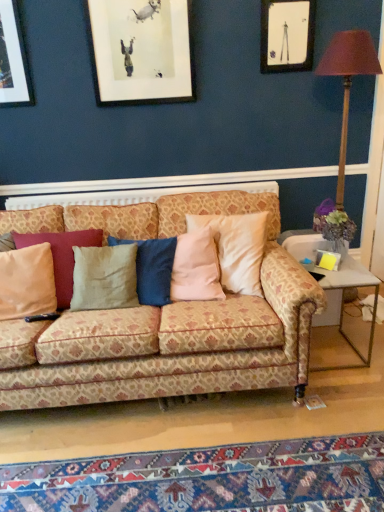
Question: Can you confirm if carpet with intricate patterns at lower center is positioned to the left of patterned fabric couch at center?

Choices:
 (A) yes
 (B) no

Answer: (B)

Question: Can you confirm if carpet with intricate patterns at lower center is shorter than patterned fabric couch at center?

Choices:
 (A) no
 (B) yes

Answer: (B)

Question: Is carpet with intricate patterns at lower center facing away from patterned fabric couch at center?

Choices:
 (A) yes
 (B) no

Answer: (B)

Question: From the image's perspective, is carpet with intricate patterns at lower center on top of patterned fabric couch at center?

Choices:
 (A) yes
 (B) no

Answer: (B)

Question: Is carpet with intricate patterns at lower center bigger than patterned fabric couch at center?

Choices:
 (A) no
 (B) yes

Answer: (A)

Question: Is carpet with intricate patterns at lower center beside patterned fabric couch at center?

Choices:
 (A) yes
 (B) no

Answer: (B)

Question: Is matte black picture frame at upper right placed right next to metallic gold table lamp at right?

Choices:
 (A) yes
 (B) no

Answer: (B)

Question: Does matte black picture frame at upper right have a greater height compared to metallic gold table lamp at right?

Choices:
 (A) no
 (B) yes

Answer: (A)

Question: Considering the relative sizes of matte black picture frame at upper right and metallic gold table lamp at right in the image provided, is matte black picture frame at upper right wider than metallic gold table lamp at right?

Choices:
 (A) no
 (B) yes

Answer: (A)

Question: Considering the relative positions of matte black picture frame at upper right and metallic gold table lamp at right in the image provided, is matte black picture frame at upper right to the left of metallic gold table lamp at right from the viewer's perspective?

Choices:
 (A) no
 (B) yes

Answer: (B)

Question: Is matte black picture frame at upper right looking in the opposite direction of metallic gold table lamp at right?

Choices:
 (A) yes
 (B) no

Answer: (B)

Question: Is matte black picture frame at upper right smaller than metallic gold table lamp at right?

Choices:
 (A) yes
 (B) no

Answer: (A)

Question: Does carpet with intricate patterns at lower center appear on the left side of metal/glass side table at lower right?

Choices:
 (A) no
 (B) yes

Answer: (B)